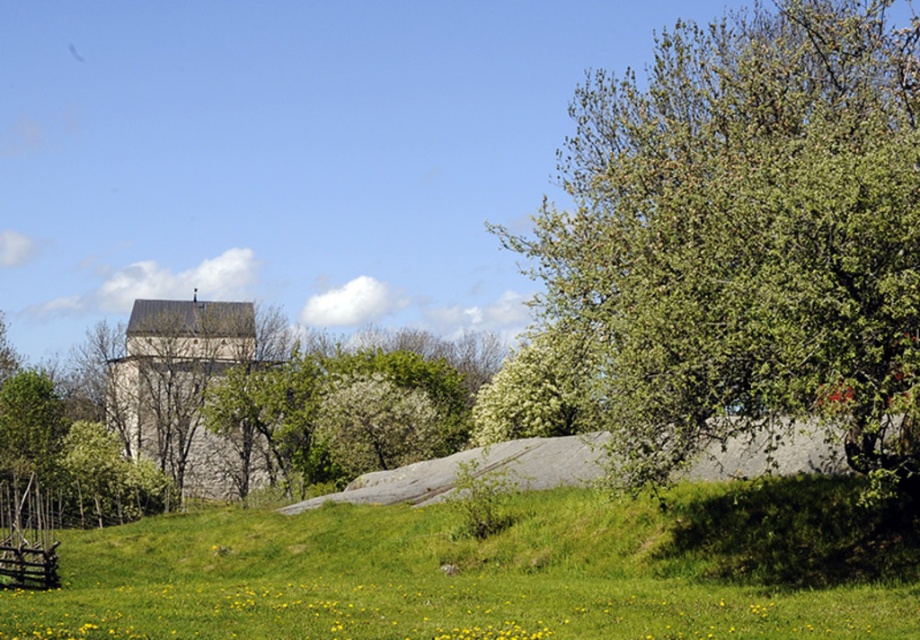
You are standing in the middle of the green grassy hill at lower center and want to reach the green leafy tree at right. Which direction should you walk to get closer to the tree?

The green leafy tree at right is located to your right side, so you should walk towards the right direction to get closer to it.

You are standing in the countryside and see the green leafy tree at right and the brown wooden fence at lower left. Which object is closer to you?

The brown wooden fence at lower left is closer to you because it is positioned under the green leafy tree at right, indicating it is in a lower and nearer position.